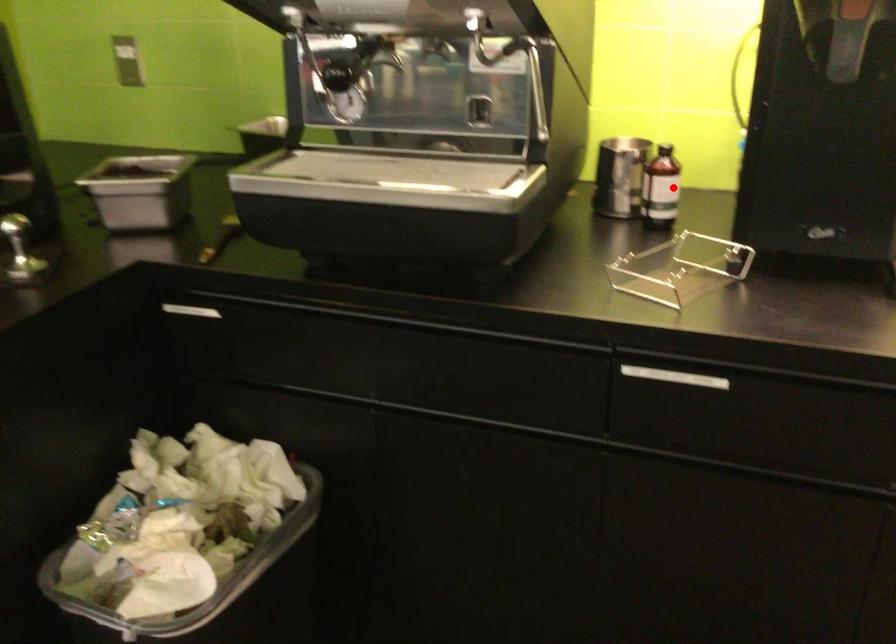
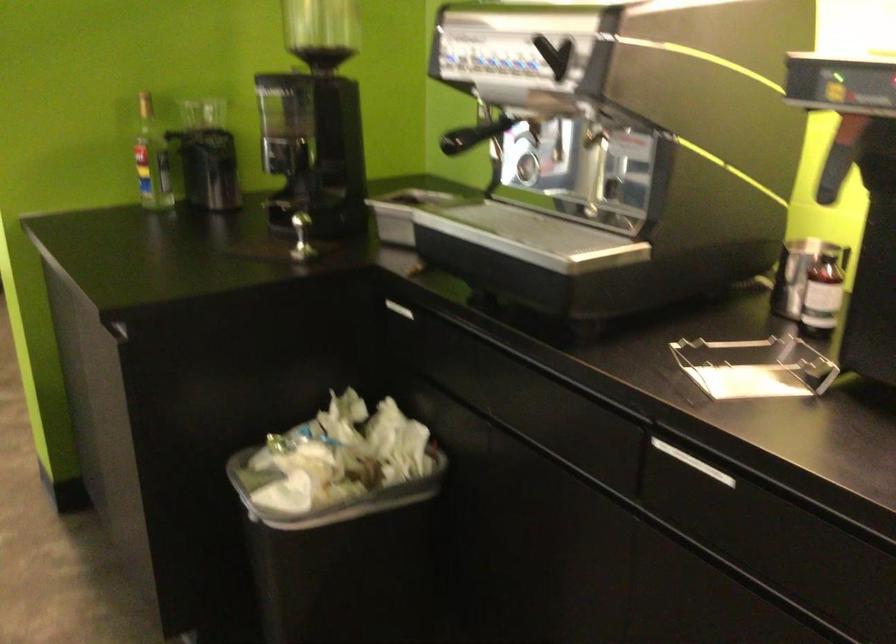
In the second image, find the point that corresponds to the highlighted location in the first image.

(822, 294)